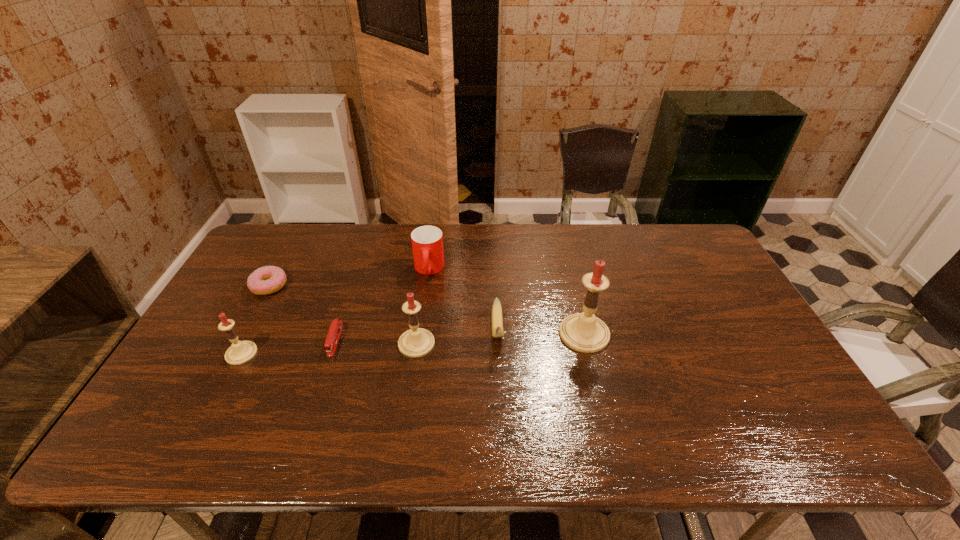
Where is `free spot between the doughnut and the second tallest object`? The width and height of the screenshot is (960, 540). free spot between the doughnut and the second tallest object is located at coordinates (343, 315).

I want to click on empty location between the fourth shortest object and the sixth shortest object, so click(422, 307).

Identify the location of vacant region between the third object from left to right and the cup. (382, 305).

Identify the location of vacant space that is in between the leftmost candle and the doughnut. The width and height of the screenshot is (960, 540). (255, 320).

Select which object appears as the fifth closest to the doughnut. Please provide its 2D coordinates. Your answer should be formatted as a tuple, i.e. [(x, y)], where the tuple contains the x and y coordinates of a point satisfying the conditions above.

[(497, 322)]

In order to click on object that can be found as the second closest to the leftmost candle in this screenshot , I will do `click(333, 336)`.

Locate an element on the screen. the closest candle relative to the cup is located at coordinates (417, 342).

Choose which candle is the nearest neighbor to the sixth shortest object. Please provide its 2D coordinates. Your answer should be formatted as a tuple, i.e. [(x, y)], where the tuple contains the x and y coordinates of a point satisfying the conditions above.

[(583, 332)]

Image resolution: width=960 pixels, height=540 pixels. What are the coordinates of `vacant point that satisfies the following two spatial constraints: 1. on the back side of the second tallest object; 2. on the right side of the rightmost candle` in the screenshot? It's located at (418, 334).